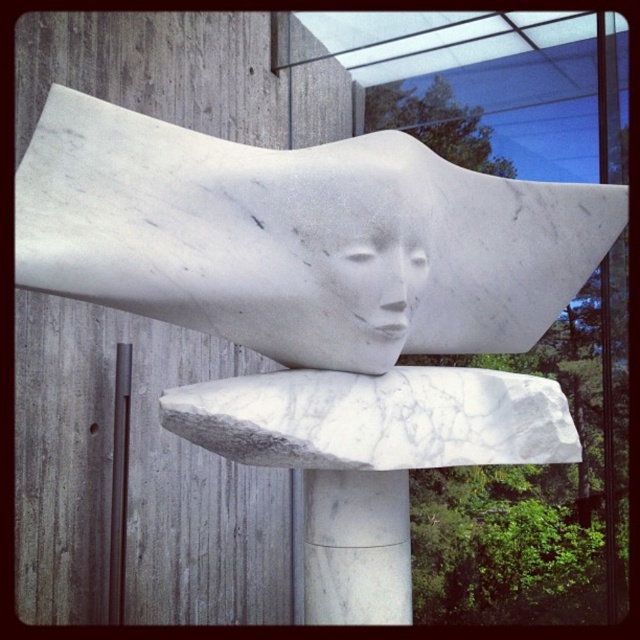
Does white marble sculpture at center have a larger size compared to white marble pillar at center?

Correct, white marble sculpture at center is larger in size than white marble pillar at center.

Does white marble sculpture at center have a lesser height compared to white marble pillar at center?

No.

Locate an element on the screen. The height and width of the screenshot is (640, 640). white marble sculpture at center is located at coordinates coord(300,237).

Between white marble pillar at center and white marble face at center, which one has more height?

Standing taller between the two is white marble face at center.

Does white marble pillar at center have a greater width compared to white marble face at center?

Yes.

Between point (400, 570) and point (394, 321), which one is positioned behind?

Positioned behind is point (400, 570).

Image resolution: width=640 pixels, height=640 pixels. Identify the location of white marble pillar at center. (356, 547).

Based on the photo, is white marble sculpture at center smaller than white marble face at center?

No, white marble sculpture at center is not smaller than white marble face at center.

Consider the image. Does white marble sculpture at center come in front of white marble face at center?

Yes, it is in front of white marble face at center.

Does point (406, 333) lie behind point (337, 241)?

Yes, it is behind point (337, 241).

Find the location of a particular element. This screenshot has width=640, height=640. white marble sculpture at center is located at coordinates (300, 237).